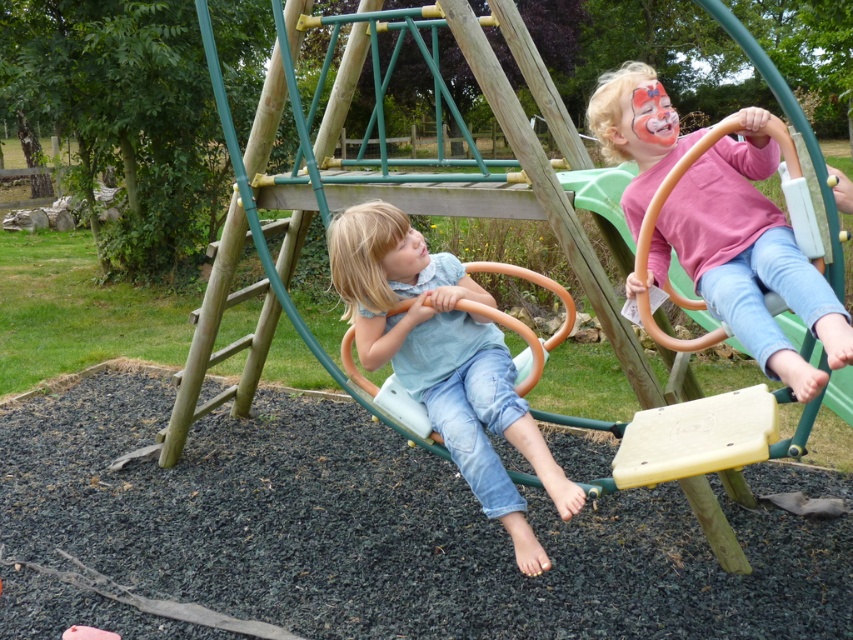
Based on the photo, does pink matte shirt at upper right have a greater height compared to light blue denim jeans at center?

Incorrect, pink matte shirt at upper right's height is not larger of light blue denim jeans at center's.

Who is shorter, pink matte shirt at upper right or light blue denim jeans at center?

pink matte shirt at upper right is shorter.

Measure the distance between point (834,362) and camera.

Point (834,362) is 8.66 feet from camera.

Image resolution: width=853 pixels, height=640 pixels. In order to click on pink matte shirt at upper right in this screenshot , I will do `click(747, 257)`.

Is point (361, 234) positioned after point (412, 272)?

No, it is in front of (412, 272).

Is light blue denim jeans at center wider than smooth skin face at center?

Correct, the width of light blue denim jeans at center exceeds that of smooth skin face at center.

Where is `light blue denim jeans at center`? This screenshot has height=640, width=853. light blue denim jeans at center is located at coordinates (445, 365).

Find the location of a particular element. This screenshot has height=640, width=853. light blue denim jeans at center is located at coordinates (445, 365).

Is point (747, 244) positioned before point (408, 280)?

Yes, it is.

Between pink matte shirt at upper right and smooth skin face at center, which one appears on the right side from the viewer's perspective?

pink matte shirt at upper right

Locate an element on the screen. pink matte shirt at upper right is located at coordinates (747, 257).